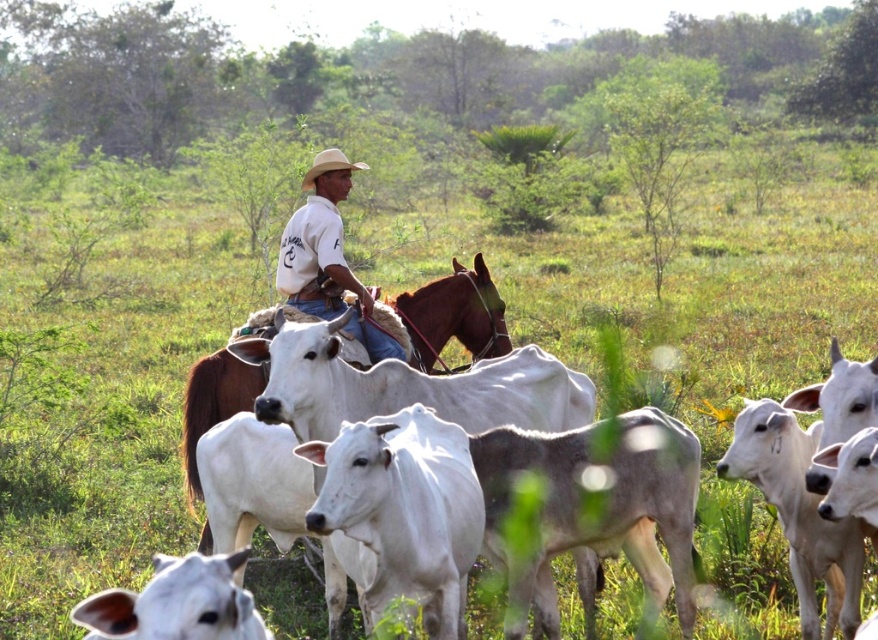
Question: Is brown leather horse at center bigger than light brown straw cowboy hat at center?

Choices:
 (A) no
 (B) yes

Answer: (A)

Question: Is gray smooth cow at center positioned before brown leather horse at center?

Choices:
 (A) no
 (B) yes

Answer: (B)

Question: Among these objects, which one is nearest to the camera?

Choices:
 (A) light brown straw cowboy hat at center
 (B) white cotton shirt at center
 (C) gray smooth cow at center

Answer: (B)

Question: Which point is closer to the camera?

Choices:
 (A) (301, 218)
 (B) (335, 157)
 (C) (509, 563)
 (D) (473, 339)

Answer: (C)

Question: Can you confirm if gray smooth cow at center is positioned below light brown straw cowboy hat at center?

Choices:
 (A) yes
 (B) no

Answer: (A)

Question: Which of these objects is positioned farthest from the light brown straw cowboy hat at center?

Choices:
 (A) gray smooth cow at center
 (B) white cotton shirt at center

Answer: (B)